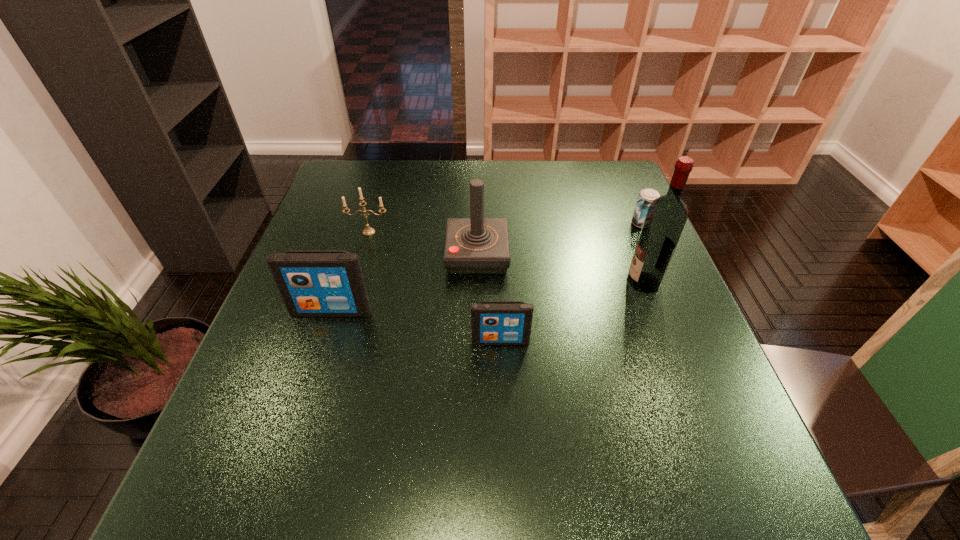
Where is `the taller iPod`? the taller iPod is located at coordinates (313, 283).

You are a GUI agent. You are given a task and a screenshot of the screen. Output one action in this format:
    pyautogui.click(x=<x>, y=<y>)
    Task: Click on the farther iPod
    The width and height of the screenshot is (960, 540).
    Given the screenshot: What is the action you would take?
    pyautogui.click(x=313, y=283)

The image size is (960, 540). Find the location of `the nearest object`. the nearest object is located at coordinates (492, 322).

You are a GUI agent. You are given a task and a screenshot of the screen. Output one action in this format:
    pyautogui.click(x=<x>, y=<y>)
    Task: Click on the nearer iPod
    The height and width of the screenshot is (540, 960).
    Given the screenshot: What is the action you would take?
    pyautogui.click(x=492, y=322)

Identify the location of joystick. (476, 245).

At what (x,y) coordinates should I click in order to perform the action: click on beer can. Please return your answer as a coordinate pair (x, y). Looking at the image, I should click on (646, 196).

This screenshot has width=960, height=540. What are the coordinates of `alcohol` in the screenshot? It's located at (665, 219).

This screenshot has height=540, width=960. Identify the location of candle. (368, 231).

This screenshot has width=960, height=540. In order to click on free space located on the front screen of the farther iPod in this screenshot , I will do `click(304, 395)`.

Locate an element on the screen. vacant space located 0.150m on the front screen of the nearest object is located at coordinates (503, 413).